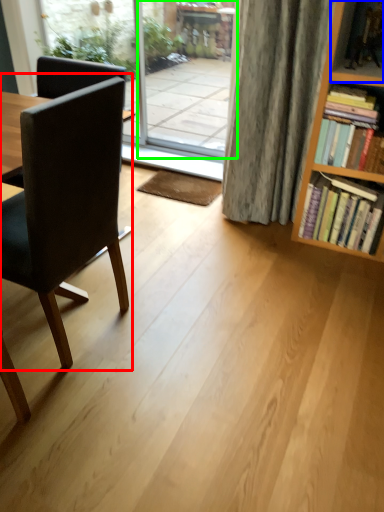
Question: Which object is the farthest from chair (highlighted by a red box)? Choose among these: shelf (highlighted by a blue box) or screen door (highlighted by a green box).

Choices:
 (A) shelf
 (B) screen door

Answer: (B)